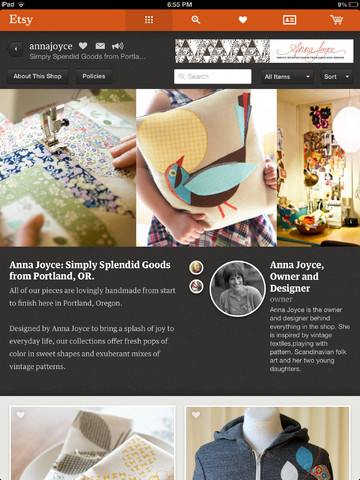
Identify the location of sewing machine. [35, 102].